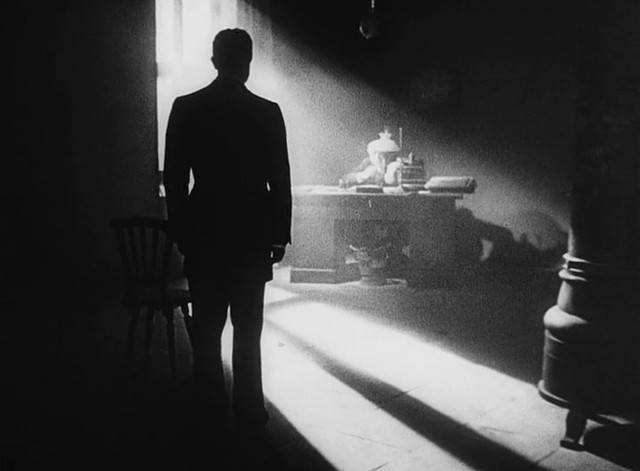
This screenshot has width=640, height=471. What are the coordinates of `desk` in the screenshot? It's located at (330, 211).